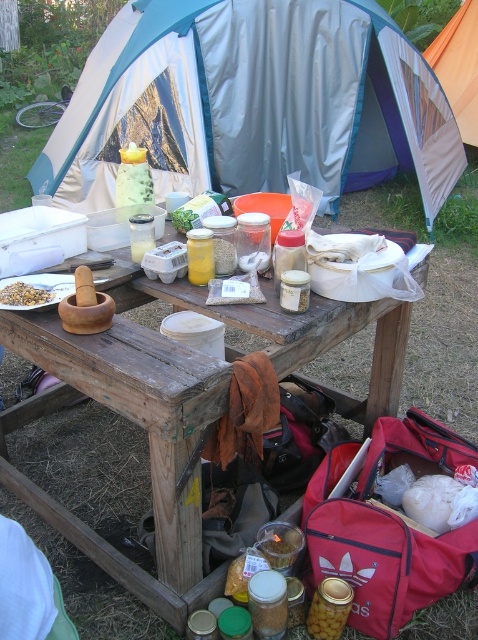
In the scene shown: You are setting up a campsite and need to place a map on the wooden picnic table at center. However, there is a yellow glass jar at center in the way. To clear space, which object should you move to the right to make room for the map?

You should move the yellow glass jar at center to the right since the wooden picnic table at center is to the left of it, allowing space for the map.

You are planning to set up a tent in this camping scene. Considering the orange fabric tent at upper center and the brown grain at center, which object is taller?

The orange fabric tent at upper center is taller than the brown grain at center.

What is located at the point with coordinates (458,67) in the image?

The orange fabric tent at upper center is located at the point with coordinates (458,67).